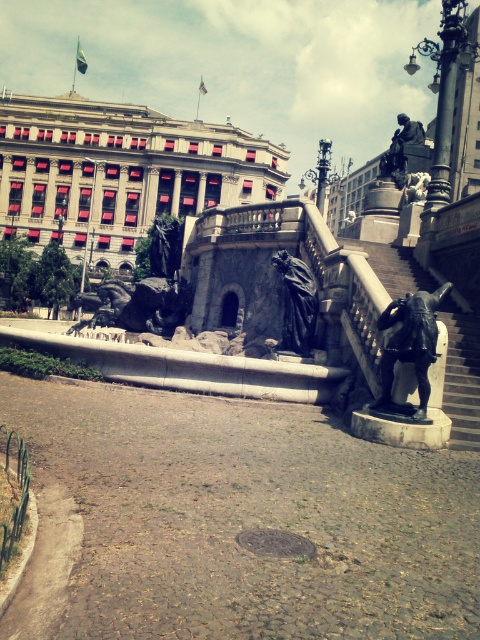
Question: Does matte red building at upper left appear over black stone stairs at center right?

Choices:
 (A) no
 (B) yes

Answer: (B)

Question: Is matte red building at upper left smaller than black polished statue at center?

Choices:
 (A) yes
 (B) no

Answer: (B)

Question: Which object is the farthest from the black stone stairs at center right?

Choices:
 (A) black polished stone statue at center
 (B) black polished statue at center

Answer: (B)

Question: Which object is positioned farthest from the black stone stairs at center right?

Choices:
 (A) matte red building at upper left
 (B) black polished stone statue at center

Answer: (A)

Question: Among these points, which one is nearest to the camera?

Choices:
 (A) (204, 180)
 (B) (452, 388)
 (C) (283, 333)

Answer: (B)

Question: Can you confirm if matte red building at upper left is bigger than black polished stone statue at center?

Choices:
 (A) yes
 (B) no

Answer: (A)